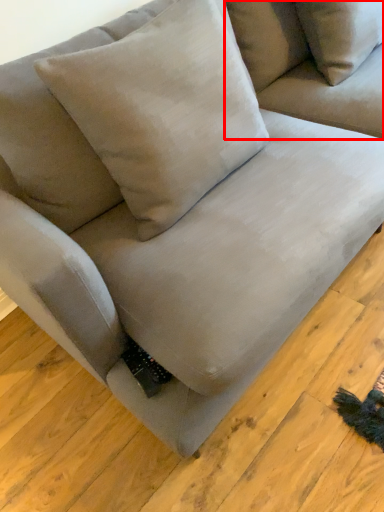
Question: From the image's perspective, what is the correct spatial positioning of couch (annotated by the red box) in reference to pillow?

Choices:
 (A) below
 (B) above

Answer: (B)